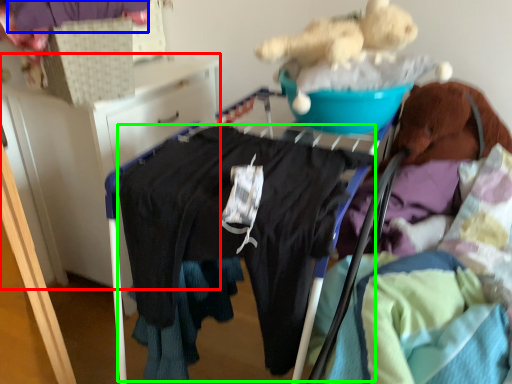
Question: Which object is the farthest from furniture (highlighted by a red box)? Choose among these: clothing (highlighted by a blue box) or clothing (highlighted by a green box).

Choices:
 (A) clothing
 (B) clothing

Answer: (B)